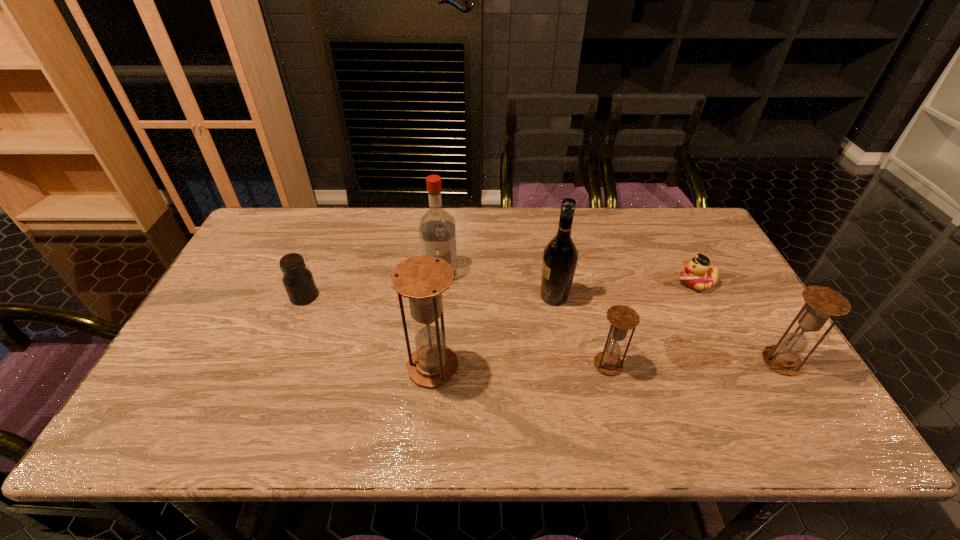
Identify the location of the tallest hourglass. click(422, 279).

The height and width of the screenshot is (540, 960). I want to click on the third object from right to left, so click(x=622, y=318).

At what (x,y) coordinates should I click in order to perform the action: click on the second hourglass from left to right. Please return your answer as a coordinate pair (x, y). This screenshot has width=960, height=540. Looking at the image, I should click on (622, 318).

This screenshot has height=540, width=960. Find the location of `the rightmost hourglass`. the rightmost hourglass is located at coordinates (822, 302).

The width and height of the screenshot is (960, 540). In order to click on the rightmost object in this screenshot , I will do `click(822, 302)`.

The height and width of the screenshot is (540, 960). Find the location of `the leftmost object`. the leftmost object is located at coordinates (298, 281).

This screenshot has width=960, height=540. I want to click on jar, so click(298, 281).

This screenshot has height=540, width=960. In order to click on wine bottle in this screenshot , I will do `click(560, 256)`.

Where is `liquor`? liquor is located at coordinates (437, 232).

Image resolution: width=960 pixels, height=540 pixels. In order to click on duck in this screenshot , I will do `click(696, 274)`.